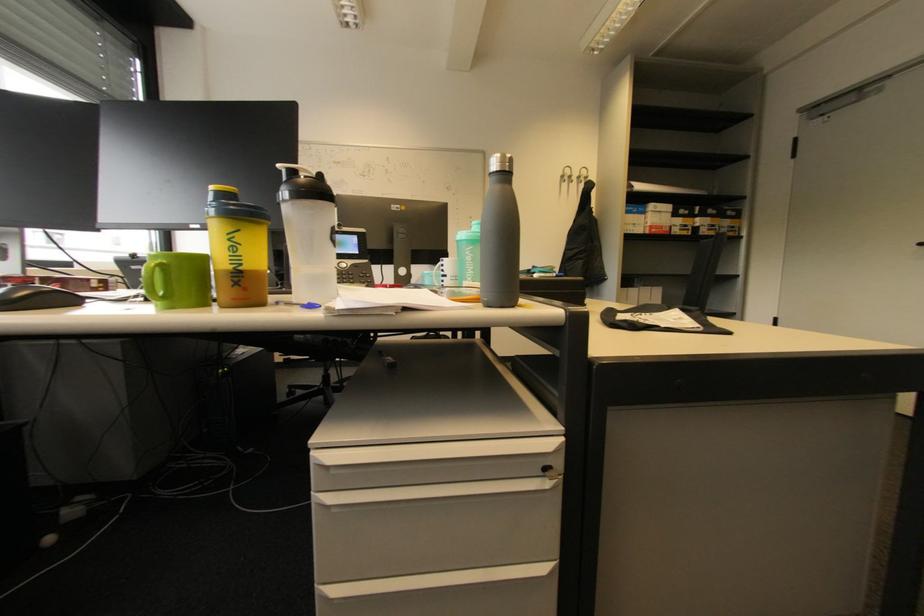
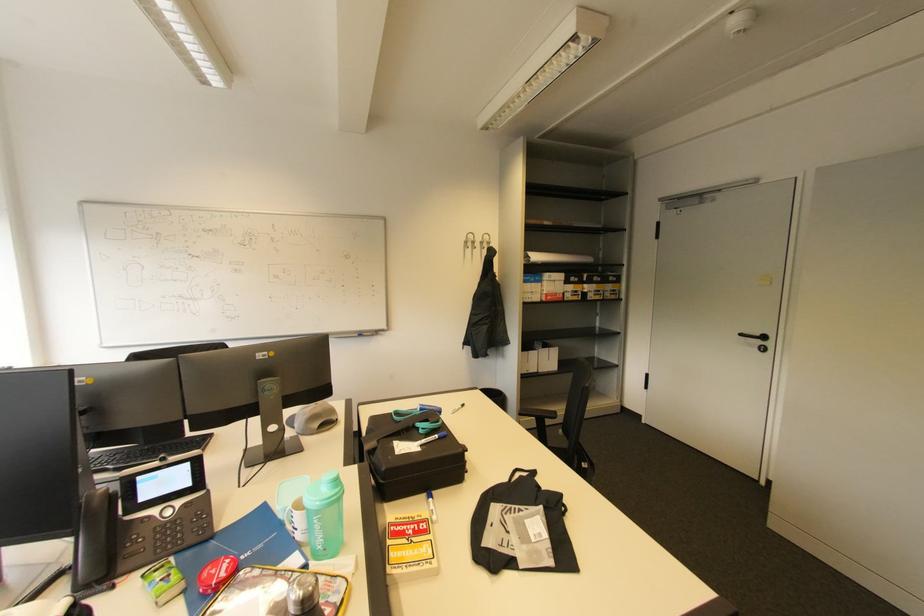
Question: I am providing you with two images of the same scene from different viewpoints. After the viewpoint changes to image2, which objects are now occluded?

Choices:
 (A) telephone handset
 (B) grey baseball cap
 (C) white marker
 (D) none of these

Answer: (D)